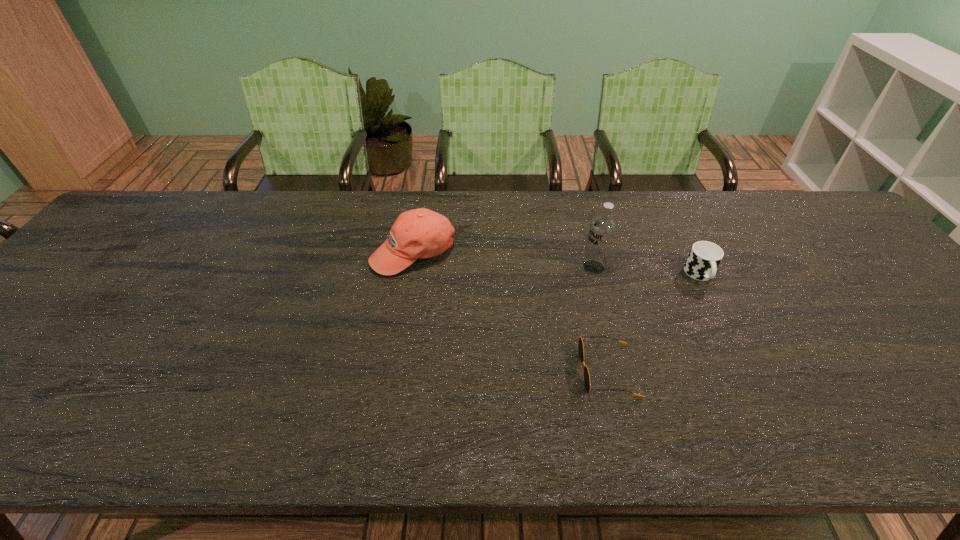
At what (x,y) coordinates should I click in order to perform the action: click on object that is the second closest one to the tallest object. Please return your answer as a coordinate pair (x, y). Image resolution: width=960 pixels, height=540 pixels. Looking at the image, I should click on (580, 343).

Find the location of a particular element. free space that satisfies the following two spatial constraints: 1. on the side of the second shortest object with the handle; 2. on the front-facing side of the sunglasses is located at coordinates (748, 370).